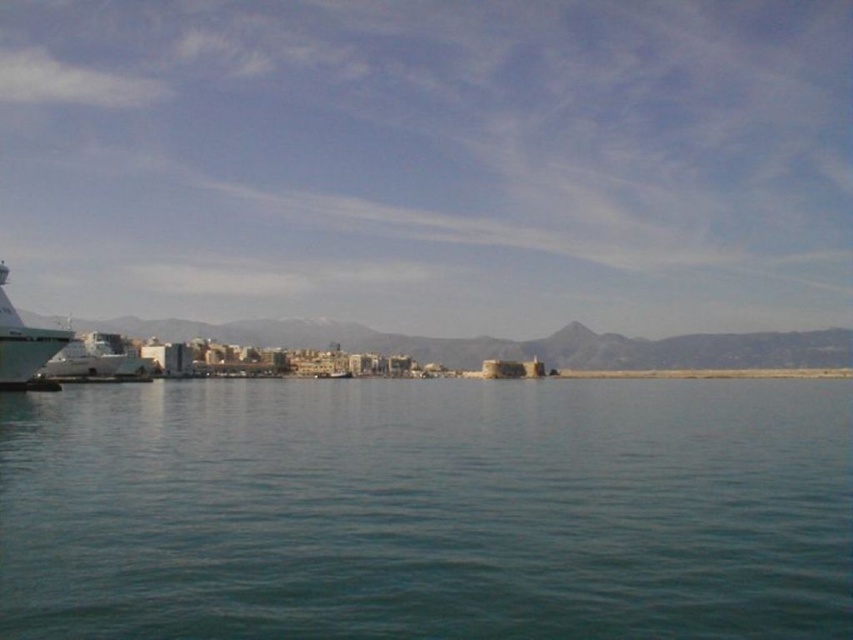
You are a photographer planning to capture the reflection of the white glossy boat at left in the clear blue water at center. Based on the scene, will the reflection of the boat be fully visible in the water?

The clear blue water at center has a lesser height compared to white glossy boat at left, so the reflection of the white glossy boat at left may not be fully visible in the clear blue water at center due to the water being lower in height.